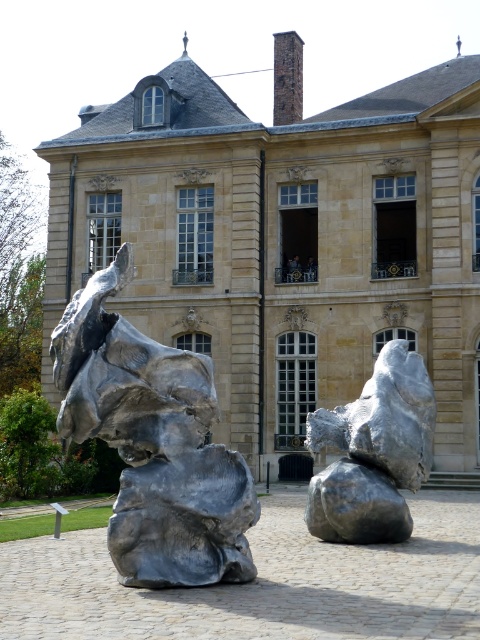
You are an art curator planning to install a new light fixture that is 2 meters tall between the matte stone sculpture at center and the brushed metal rock at center. Based on their heights, will the new light fixture be taller than both existing sculptures?

The matte stone sculpture at center is taller than the brushed metal rock at center. Since the new light fixture is 2 meters tall, we need to compare it to the height of the taller sculpture. If the matte stone sculpture at center is taller than 2 meters, then the light fixture would be shorter. However, if the matte stone sculpture at center is shorter than 2 meters, the light fixture would be taller. Unfortunately, the exact heights are not provided, so we cannot definitively determine the answer based on

You are standing in front of the historic building and want to take a photo that includes both the matte stone sculpture at center and the brushed metal rock at center. Which sculpture should you position closer to the left side of your camera frame to ensure both are visible?

You should position the matte stone sculpture at center closer to the left side of your camera frame because it is already to the left of the brushed metal rock at center, so aligning it to the left maintains their natural spatial arrangement while ensuring both fit within the frame.